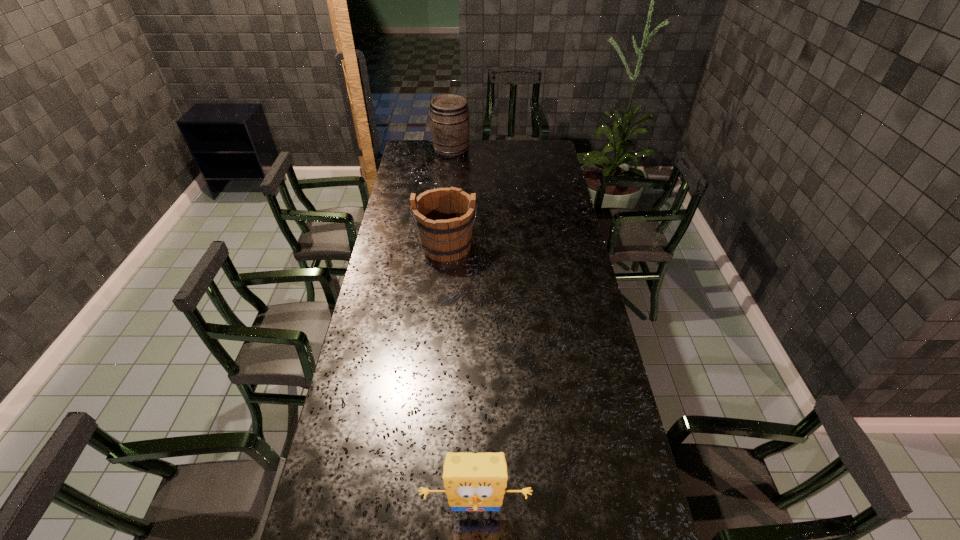
The height and width of the screenshot is (540, 960). In order to click on the farthest object in this screenshot , I will do `click(450, 127)`.

Identify the location of the nearer wine bucket. (443, 217).

Where is `the nearest object`? This screenshot has height=540, width=960. the nearest object is located at coordinates (473, 481).

Locate an element on the screen. This screenshot has width=960, height=540. vacant space located on the left of the farthest object is located at coordinates (417, 150).

Locate an element on the screen. The height and width of the screenshot is (540, 960). free location located 0.260m on the side of the second farthest object with the handle for carrying is located at coordinates (441, 313).

Where is `object situated at the far edge`? The height and width of the screenshot is (540, 960). object situated at the far edge is located at coordinates (450, 127).

The width and height of the screenshot is (960, 540). I want to click on object that is positioned at the far left corner, so click(450, 127).

Where is `free region at the far edge`? free region at the far edge is located at coordinates (469, 157).

This screenshot has width=960, height=540. I want to click on vacant space at the left edge, so click(x=331, y=454).

In the image, there is a desktop. Where is `free region at the right edge`? This screenshot has height=540, width=960. free region at the right edge is located at coordinates (554, 270).